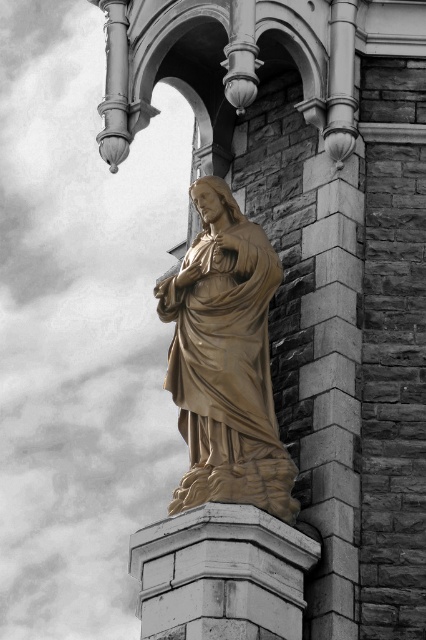
Consider the image. You are a maintenance worker who needs to clean both the gold polished stone statue at center and the white stone pedestal at center. You have a ladder that is 3.5 meters long. Can you reach both objects with the ladder without moving it?

The gold polished stone statue at center and white stone pedestal at center are 4.06 meters apart from each other. Since the ladder is only 3.5 meters long, it is not long enough to span the distance between them. You will need to move the ladder to reach both objects.

You are an art conservator assessing the placement of the gold polished stone statue at center and the white stone pedestal at center. Based on their positions, which object is located higher in the image?

The gold polished stone statue at center is above the white stone pedestal at center, so it is higher.